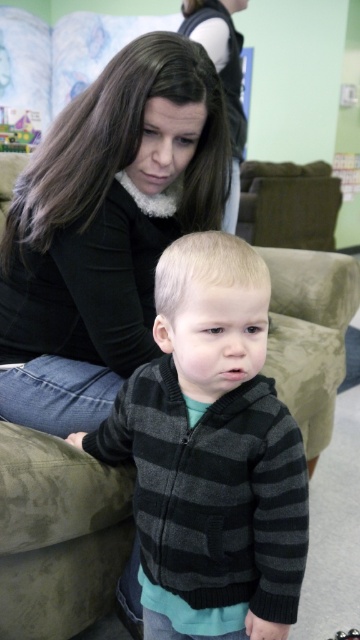
You are a fashion designer observing the image. You need to determine which item is shorter between the matte black sweater at center and the dark brown hair at upper center. Which one is shorter?

The matte black sweater at center is shorter than the dark brown hair at upper center.

You are a fashion designer trying to create a layered outfit using the matte black sweater at center and the striped knit sweater at center. Which sweater should you place underneath to ensure proper visibility of both layers?

The striped knit sweater at center should be placed underneath the matte black sweater at center because the matte black sweater at center is taller, allowing the striped knit sweater at center to show beneath it.